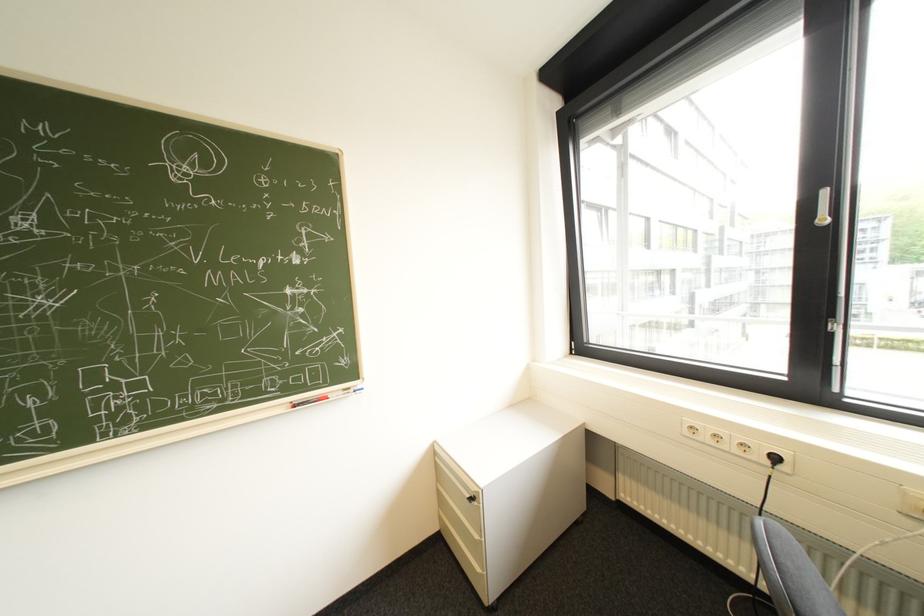
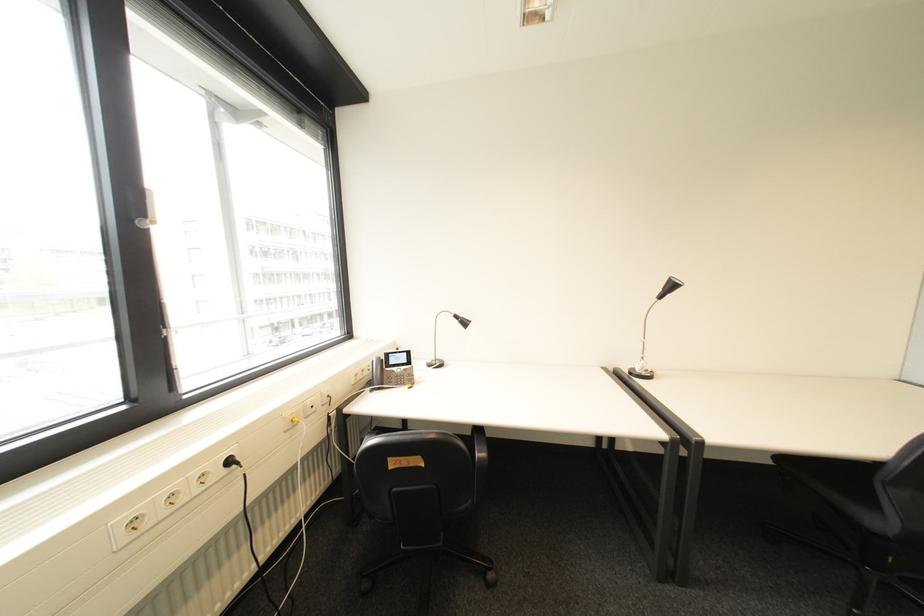
Where in the second image is the point corresponding to [785,459] from the first image?

(239, 463)